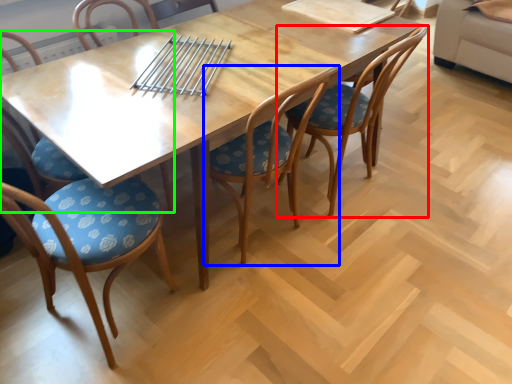
Question: Based on their relative distances, which object is farther from chair (highlighted by a red box)? Choose from chair (highlighted by a blue box) and chair (highlighted by a green box).

Choices:
 (A) chair
 (B) chair

Answer: (B)